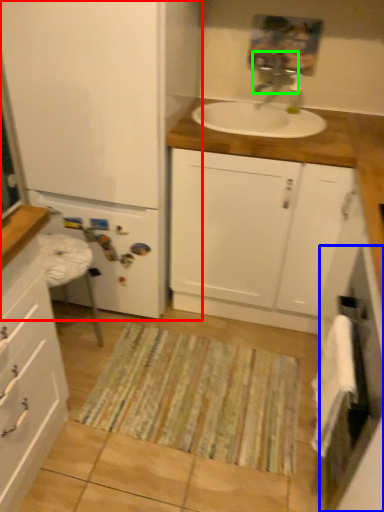
Question: Considering the real-world distances, which object is farthest from bathroom cabinet (highlighted by a red box)? screen door (highlighted by a blue box) or tap (highlighted by a green box)?

Choices:
 (A) screen door
 (B) tap

Answer: (A)